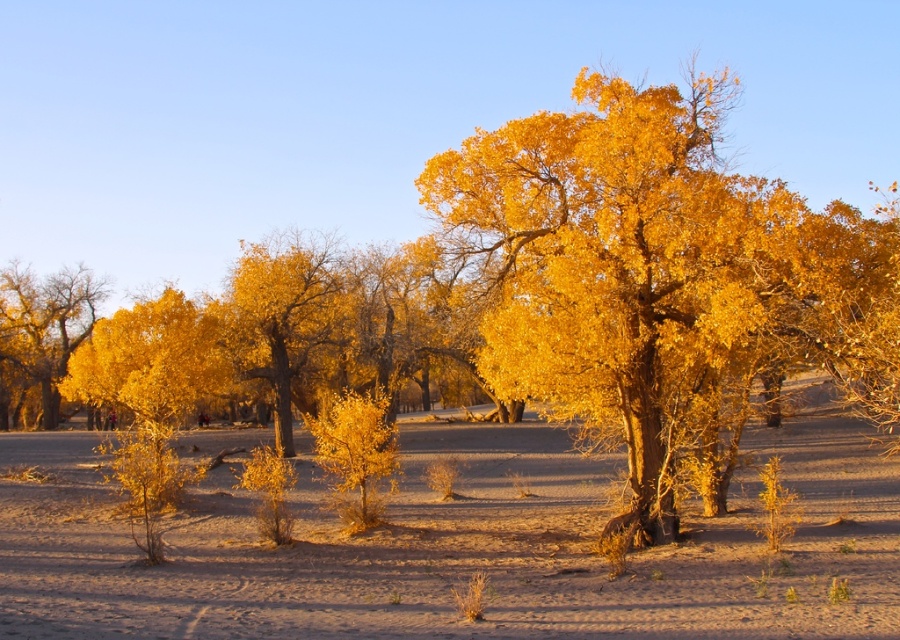
Is golden textured tree at center further to the viewer compared to golden matte tree at center?

No, it is not.

Who is higher up, golden textured tree at center or golden matte tree at center?

golden textured tree at center

Which is behind, point (631, 429) or point (235, 349)?

Positioned behind is point (235, 349).

At what (x,y) coordinates should I click in order to perform the action: click on golden textured tree at center. Please return your answer as a coordinate pair (x, y). This screenshot has width=900, height=640. Looking at the image, I should click on (662, 282).

Does dried sand at center have a greater width compared to golden matte tree at center?

Correct, the width of dried sand at center exceeds that of golden matte tree at center.

Identify the location of dried sand at center. (460, 547).

Where is `dried sand at center`? This screenshot has width=900, height=640. dried sand at center is located at coordinates (460, 547).

Is dried sand at center smaller than golden textured bush at left?

No.

Measure the distance between dried sand at center and camera.

dried sand at center and camera are 36.28 feet apart from each other.

The image size is (900, 640). Find the location of `dried sand at center`. dried sand at center is located at coordinates (460, 547).